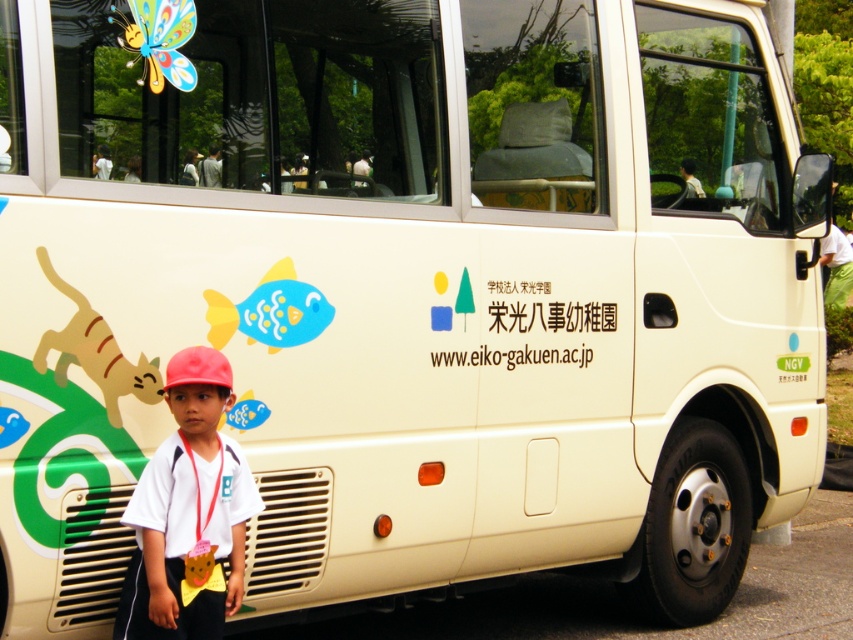
Can you confirm if white matte shirt at lower left is thinner than white paper sign at center?

Yes.

Does white matte shirt at lower left appear on the left side of white paper sign at center?

Indeed, white matte shirt at lower left is positioned on the left side of white paper sign at center.

Is point (132, 616) positioned behind point (521, 324)?

No, (132, 616) is closer to viewer.

What are the coordinates of `white matte shirt at lower left` in the screenshot? It's located at (189, 513).